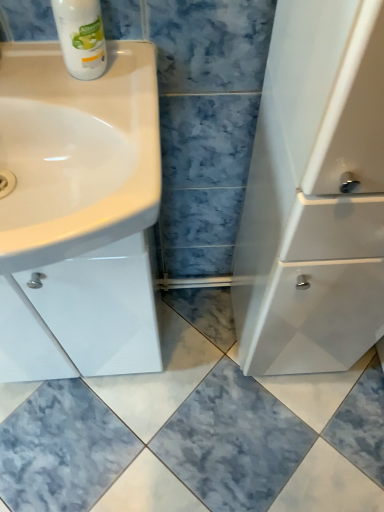
Locate an element on the screen. free point in front of white glossy bottle at upper left is located at coordinates (86, 129).